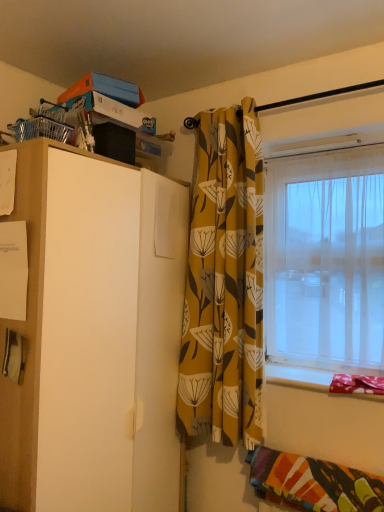
Image resolution: width=384 pixels, height=512 pixels. I want to click on free space above fabric covered window sill at lower right (from a real-world perspective), so click(317, 372).